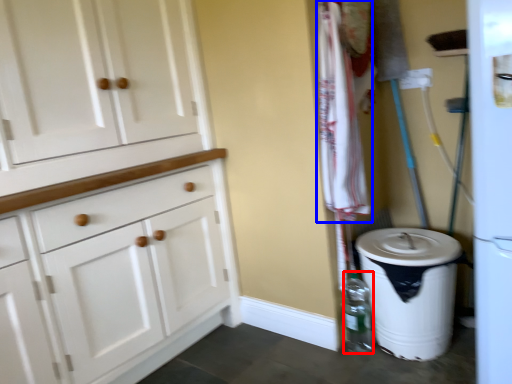
Question: Which object appears farthest to the camera in this image, bottle (highlighted by a red box) or laundry (highlighted by a blue box)?

Choices:
 (A) bottle
 (B) laundry

Answer: (A)